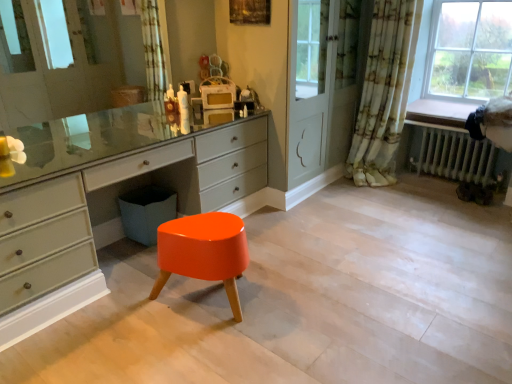
The image size is (512, 384). In order to click on vacant point above glossy orange stool at center (from a real-world perspective) in this screenshot , I will do `click(204, 228)`.